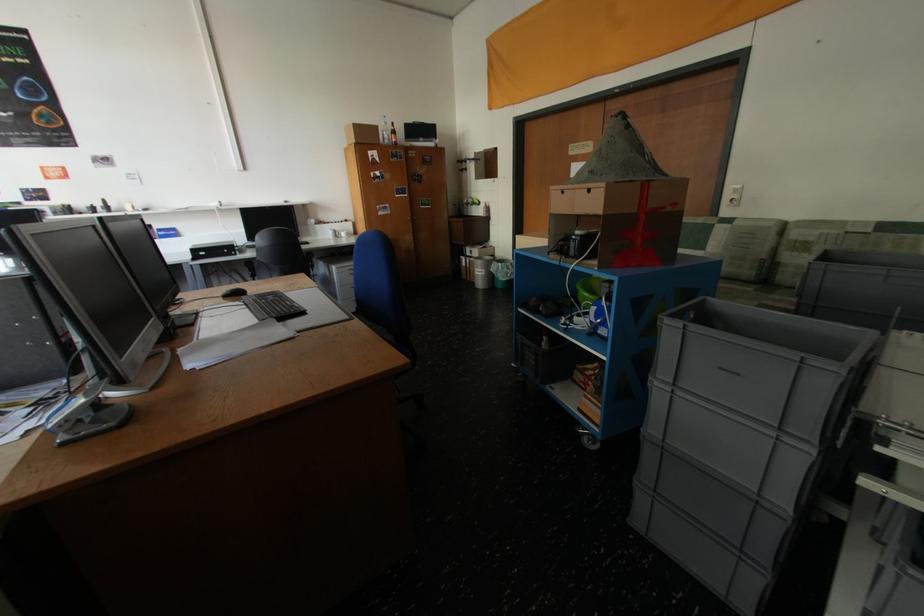
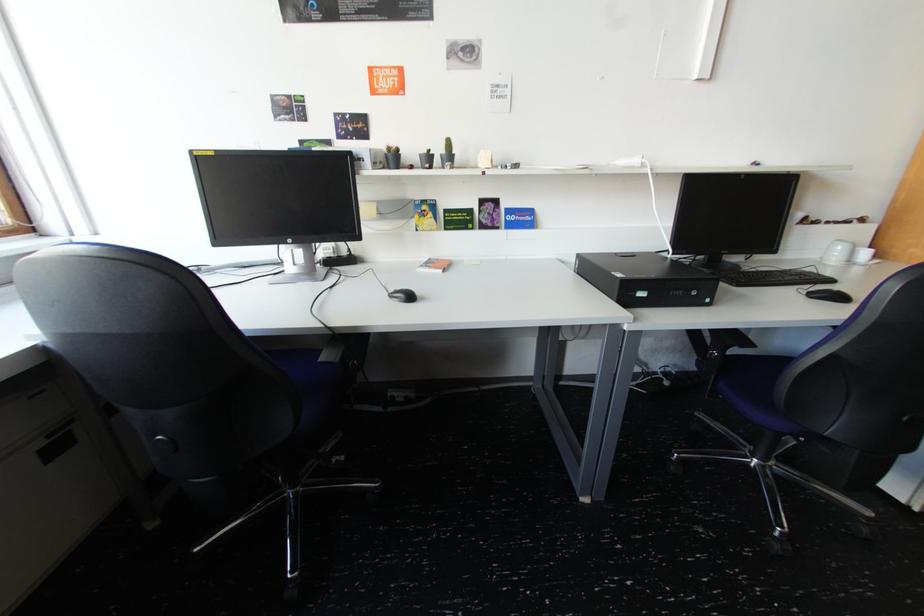
Find the pixel in the second image that matches point (73, 207) in the first image.

(397, 150)